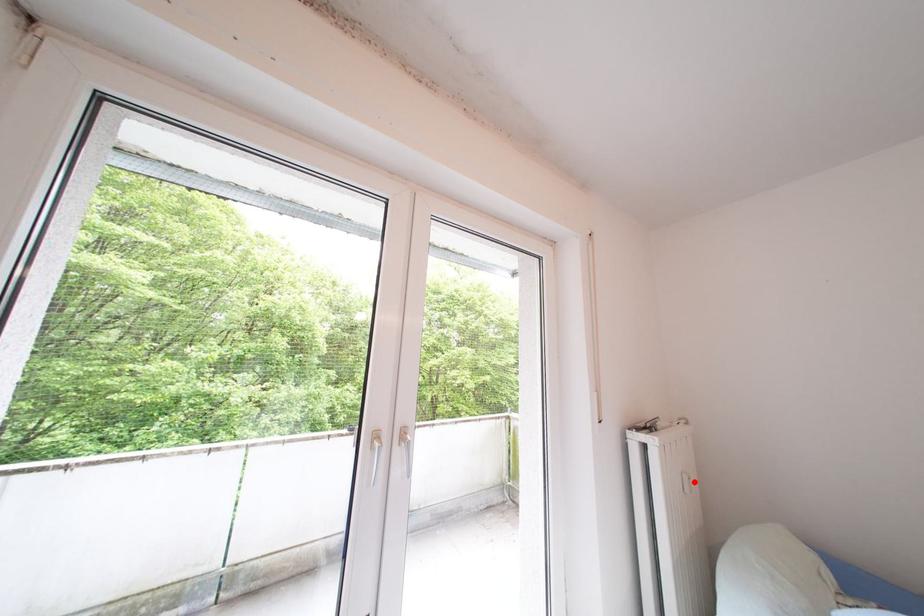
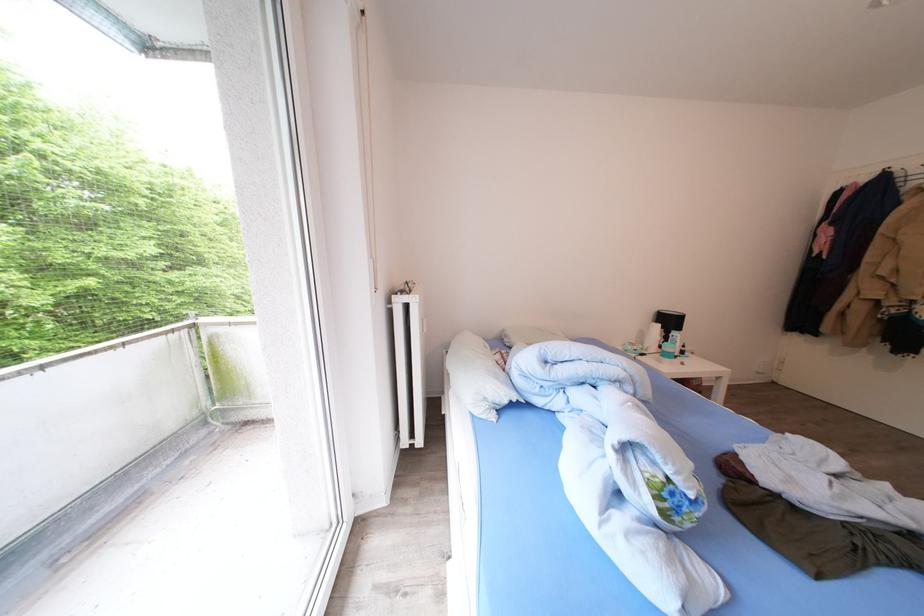
Where in the second image is the point corresponding to the highlighted location from the first image?

(433, 326)